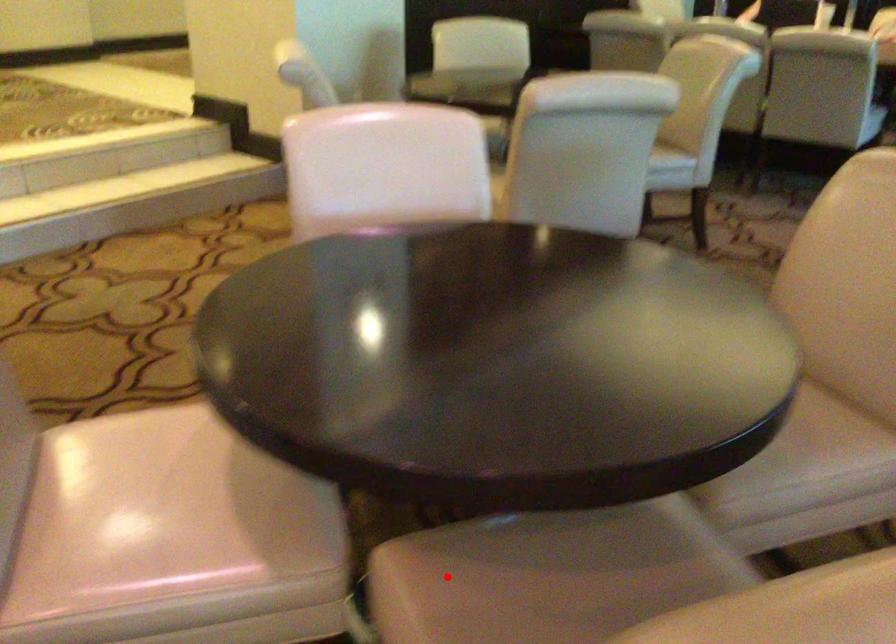
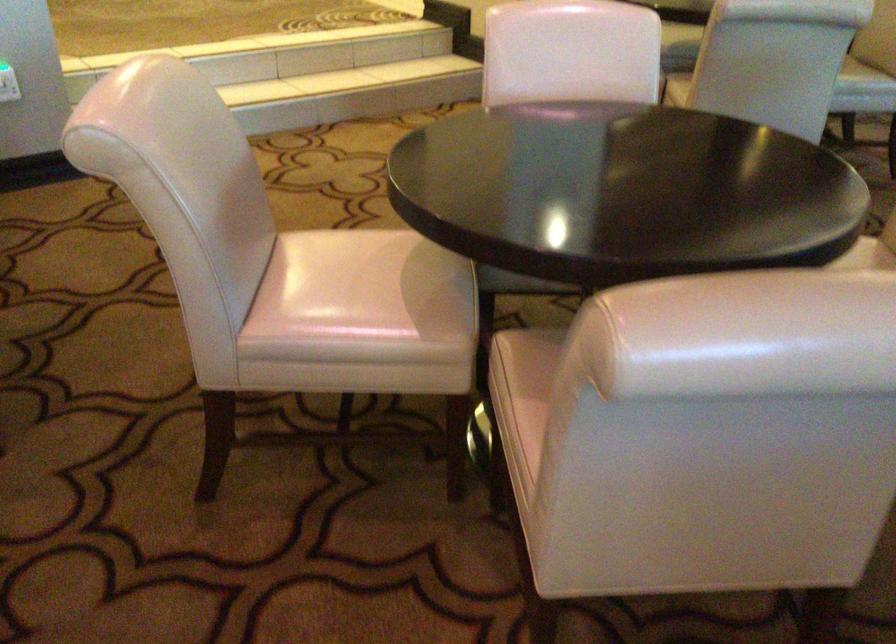
Question: A red point is marked in image1. In image2, is the corresponding 3D point closer to the camera or farther? Reply with the corresponding letter.

Choices:
 (A) The corresponding 3D point is closer.
 (B) The corresponding 3D point is farther.

Answer: (B)